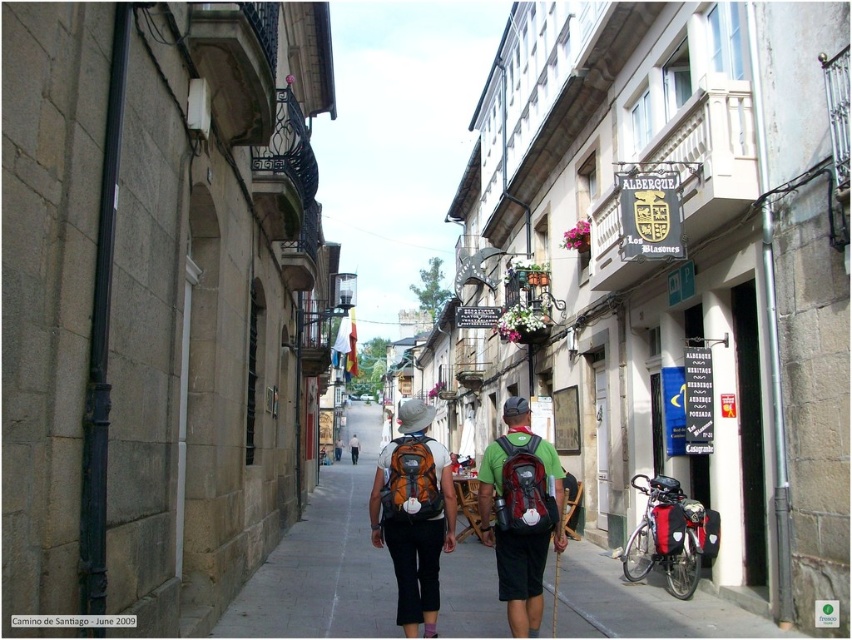
Question: Does gray concrete pavement at center have a greater width compared to matte green backpack at center?

Choices:
 (A) yes
 (B) no

Answer: (A)

Question: Which of the following is the closest to the observer?

Choices:
 (A) orange fabric backpack at center
 (B) matte orange backpack at center
 (C) gray concrete pavement at center
 (D) matte green backpack at center

Answer: (B)

Question: Can you confirm if orange fabric backpack at center is positioned to the left of matte green backpack at center?

Choices:
 (A) yes
 (B) no

Answer: (A)

Question: Which point is closer to the camera?

Choices:
 (A) matte green backpack at center
 (B) matte orange backpack at center
 (C) gray concrete pavement at center

Answer: (B)

Question: Does gray concrete pavement at center appear under matte green backpack at center?

Choices:
 (A) no
 (B) yes

Answer: (B)

Question: Which object is the closest to the matte orange backpack at center?

Choices:
 (A) gray concrete pavement at center
 (B) matte green backpack at center
 (C) orange fabric backpack at center

Answer: (C)